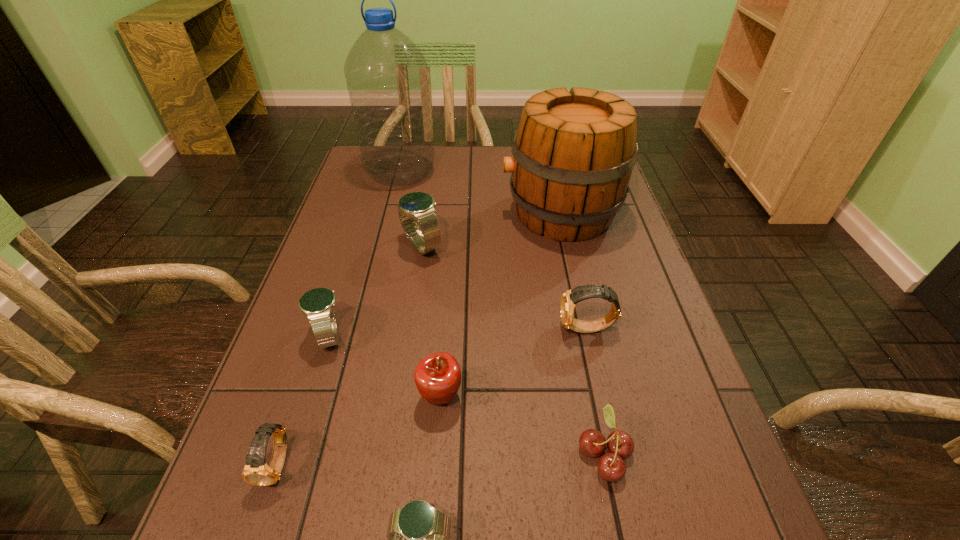
You are a GUI agent. You are given a task and a screenshot of the screen. Output one action in this format:
    pyautogui.click(x=<x>, y=<y>)
    Task: Click on the cider positioned at the right edge
    This screenshot has height=540, width=960.
    Given the screenshot: What is the action you would take?
    pyautogui.click(x=574, y=151)

Locate an element on the screen. This screenshot has width=960, height=540. watch located at the right edge is located at coordinates (570, 298).

At what (x,y) coordinates should I click in order to perform the action: click on cherry that is at the right edge. Please return your answer as a coordinate pair (x, y). The width and height of the screenshot is (960, 540). Looking at the image, I should click on (611, 466).

The height and width of the screenshot is (540, 960). I want to click on object that is at the far left corner, so click(387, 79).

Where is `object that is at the far right corner`? Image resolution: width=960 pixels, height=540 pixels. object that is at the far right corner is located at coordinates (574, 151).

Identify the location of vacant region at the left edge of the desktop. This screenshot has height=540, width=960. (325, 257).

Find the location of a particular element. vacant space at the right edge of the desktop is located at coordinates point(629,233).

Locate an element on the screen. The height and width of the screenshot is (540, 960). vacant point located between the second farthest blue watch and the sixth farthest object is located at coordinates (386, 366).

The image size is (960, 540). I want to click on empty location between the eighth shortest object and the sixth farthest object, so click(x=500, y=305).

Locate an element on the screen. The image size is (960, 540). unoccupied position between the eighth shortest object and the second biggest blue watch is located at coordinates (445, 274).